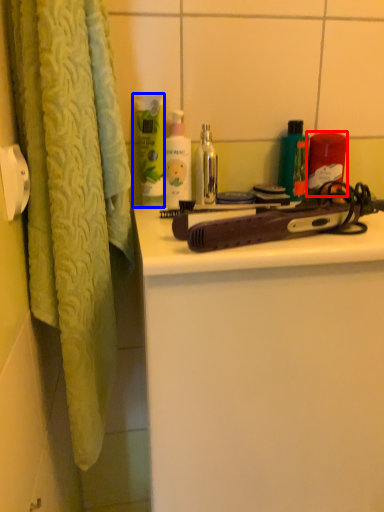
Question: Which object is further to the camera taking this photo, product (highlighted by a red box) or cleaning product (highlighted by a blue box)?

Choices:
 (A) product
 (B) cleaning product

Answer: (A)